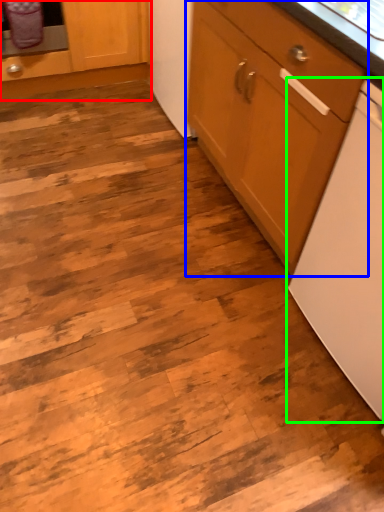
Question: Based on their relative distances, which object is nearer to cabinetry (highlighted by a red box)? Choose from cabinetry (highlighted by a blue box) and home appliance (highlighted by a green box).

Choices:
 (A) cabinetry
 (B) home appliance

Answer: (A)